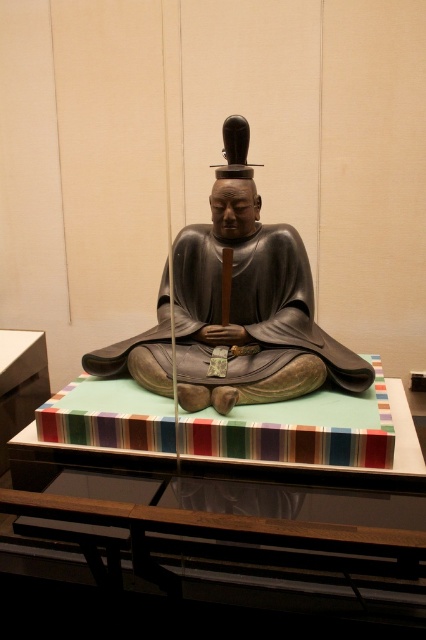
You are a museum curator arranging an exhibit. You need to place a decorative vase on the green felt table at center and ensure it doesn not block the view of the matte gray statue at center. Given their positions, where should you place the vase relative to the statue?

The green felt table at center is to the right of the matte gray statue at center. To avoid blocking the statue, place the vase on the left side of the green felt table at center so it doesn not obstruct the view from the statue.

You are a visitor in the museum and want to take a photo of the matte gray statue at center without any obstruction. Is the green felt table at center blocking your view of the statue?

The green felt table at center is closer to the viewer than the matte gray statue at center, so it is blocking the view of the statue. Move closer or adjust your angle to see the statue beyond the table.